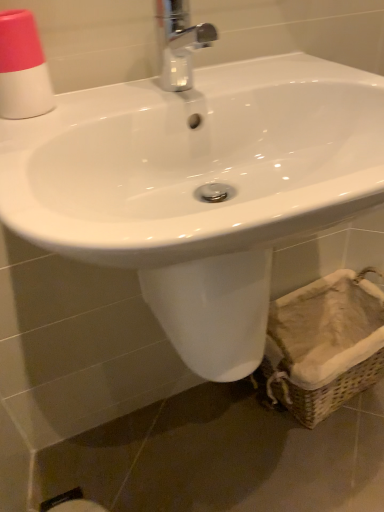
Question: Considering the relative sizes of chrome metallic faucet at upper center and white glossy sink at center in the image provided, is chrome metallic faucet at upper center wider than white glossy sink at center?

Choices:
 (A) no
 (B) yes

Answer: (A)

Question: Does chrome metallic faucet at upper center have a lesser height compared to white glossy sink at center?

Choices:
 (A) yes
 (B) no

Answer: (A)

Question: Is white glossy sink at center a part of chrome metallic faucet at upper center?

Choices:
 (A) no
 (B) yes

Answer: (A)

Question: Are chrome metallic faucet at upper center and white glossy sink at center beside each other?

Choices:
 (A) no
 (B) yes

Answer: (A)

Question: From a real-world perspective, is chrome metallic faucet at upper center physically below white glossy sink at center?

Choices:
 (A) no
 (B) yes

Answer: (A)

Question: From a real-world perspective, is white glossy sink at center above or below woven beige basket at lower right?

Choices:
 (A) above
 (B) below

Answer: (A)

Question: Is white glossy sink at center inside or outside of woven beige basket at lower right?

Choices:
 (A) inside
 (B) outside

Answer: (B)

Question: Is white glossy sink at center to the left or to the right of woven beige basket at lower right in the image?

Choices:
 (A) left
 (B) right

Answer: (A)

Question: From their relative heights in the image, would you say white glossy sink at center is taller or shorter than woven beige basket at lower right?

Choices:
 (A) short
 (B) tall

Answer: (B)

Question: From the image's perspective, is pink matte cup at upper left positioned above or below white glossy sink at center?

Choices:
 (A) below
 (B) above

Answer: (B)

Question: In the image, is pink matte cup at upper left on the left side or the right side of white glossy sink at center?

Choices:
 (A) left
 (B) right

Answer: (A)

Question: Looking at their shapes, would you say pink matte cup at upper left is wider or thinner than white glossy sink at center?

Choices:
 (A) thin
 (B) wide

Answer: (A)

Question: In terms of size, does pink matte cup at upper left appear bigger or smaller than white glossy sink at center?

Choices:
 (A) big
 (B) small

Answer: (B)

Question: From the image's perspective, relative to woven beige basket at lower right, is pink matte cup at upper left above or below?

Choices:
 (A) above
 (B) below

Answer: (A)

Question: Is pink matte cup at upper left taller or shorter than woven beige basket at lower right?

Choices:
 (A) short
 (B) tall

Answer: (A)